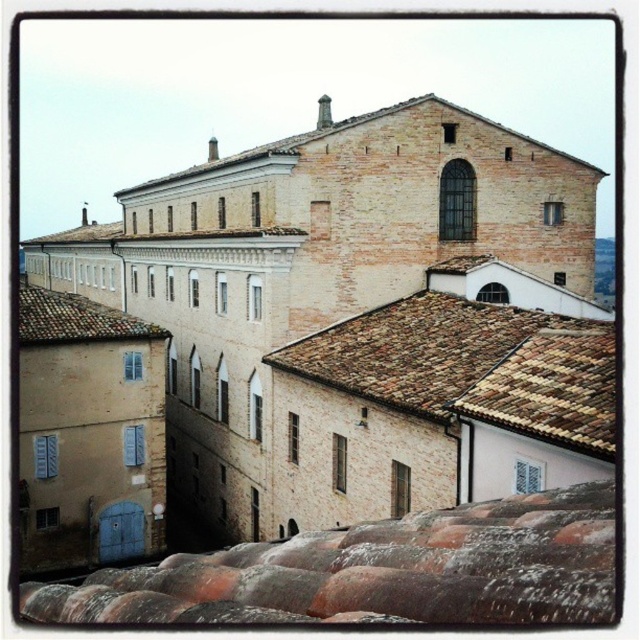
You are standing in the historic district and looking at the terracotta clay tiles at lower center and the brown tiled roof at center. Which of these two objects is positioned lower in the scene?

The terracotta clay tiles at lower center is positioned lower than the brown tiled roof at center.

You are an architect analyzing the spatial layout of the historic building complex. You observe two points marked on the image at coordinates point (602, 509) and point (554, 440). Based on the scene, which point is closer to the viewer?

Point (602, 509) is closer to the viewer because it is in front of point (554, 440) according to the spatial arrangement.